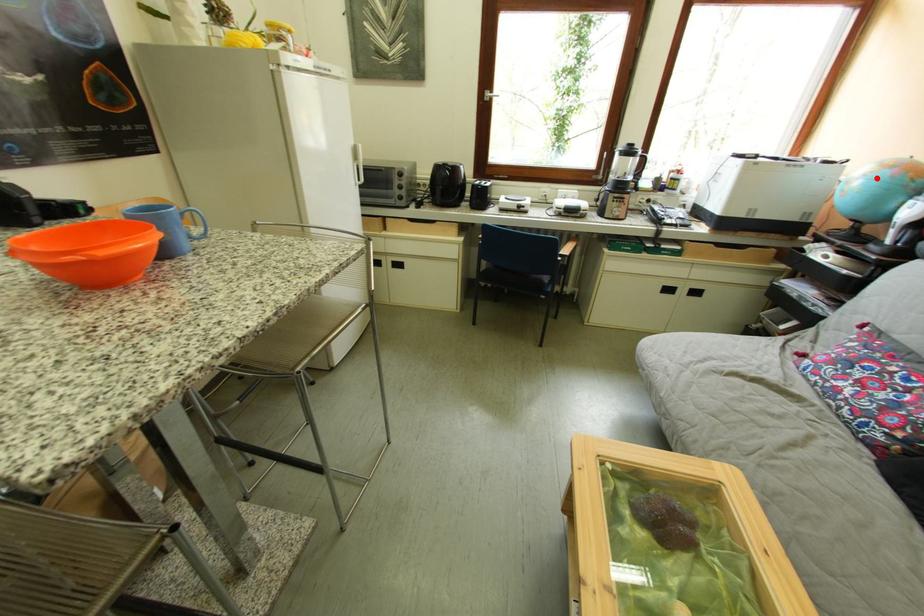
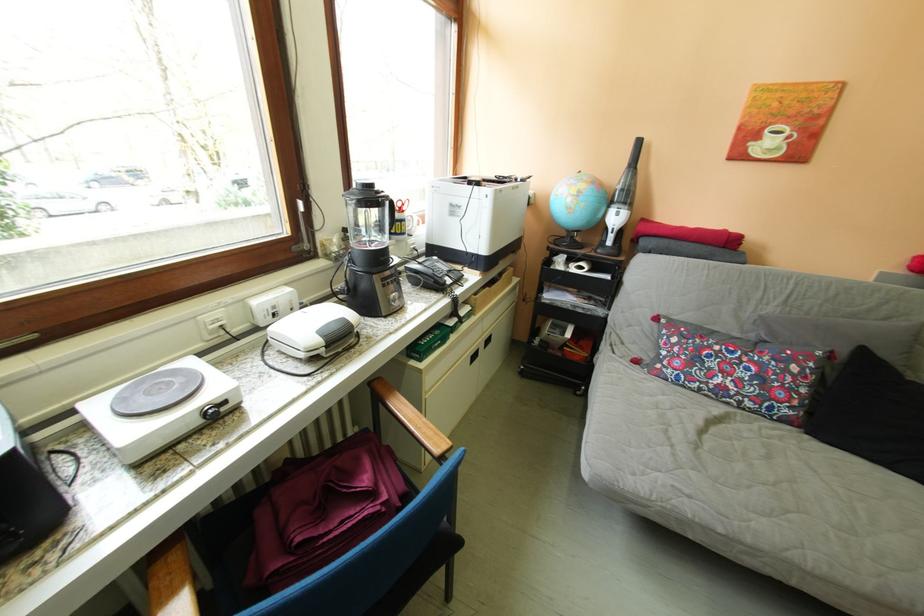
Question: I am providing you with two images of the same scene from different viewpoints. Image1 has a red point marked. In image2, the corresponding 3D location appears at what relative position? Reply with the corresponding letter.

Choices:
 (A) Closer
 (B) Farther

Answer: (A)